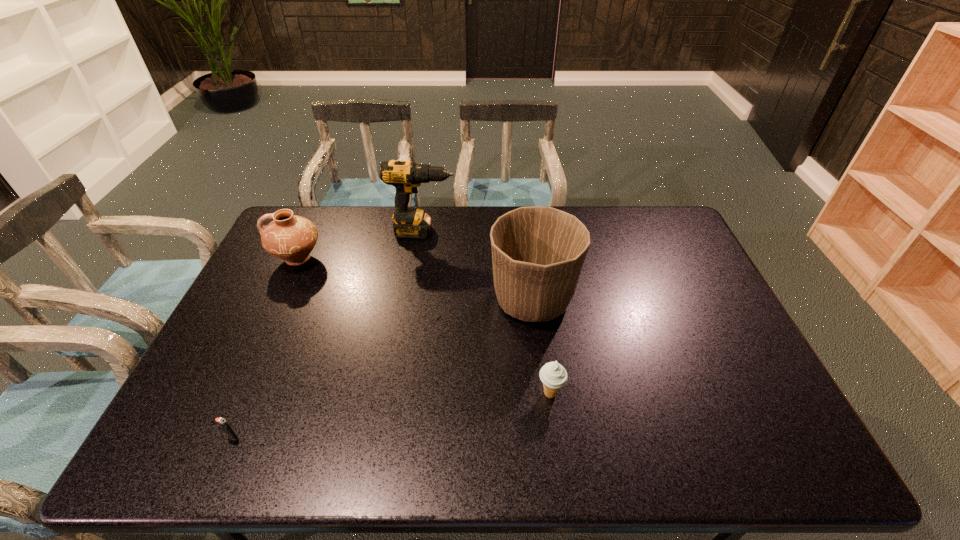
At what (x,y) coordinates should I click in order to perform the action: click on free space at the left edge of the desktop. Please return your answer as a coordinate pair (x, y). This screenshot has height=540, width=960. Looking at the image, I should click on (285, 291).

Identify the location of free space at the right edge of the desktop. The image size is (960, 540). (695, 266).

Locate an element on the screen. free space at the far right corner is located at coordinates (680, 225).

I want to click on vacant area that lies between the nearest object and the flowerpot, so click(x=383, y=369).

Find the location of `empty space that is in between the drill and the flowerpot`. empty space that is in between the drill and the flowerpot is located at coordinates (478, 266).

The image size is (960, 540). Identify the location of free area in between the flowerpot and the second nearest object. (541, 347).

The width and height of the screenshot is (960, 540). In order to click on free space that is in between the pottery and the nearest object in this screenshot , I will do `click(266, 348)`.

Find the location of a particular element. The image size is (960, 540). blank region between the fourth farthest object and the flowerpot is located at coordinates (541, 347).

Find the location of `free space between the flowerpot and the fourth tallest object`. free space between the flowerpot and the fourth tallest object is located at coordinates (541, 347).

Find the location of a particular element. This screenshot has width=960, height=540. free space between the pottery and the flowerpot is located at coordinates (415, 279).